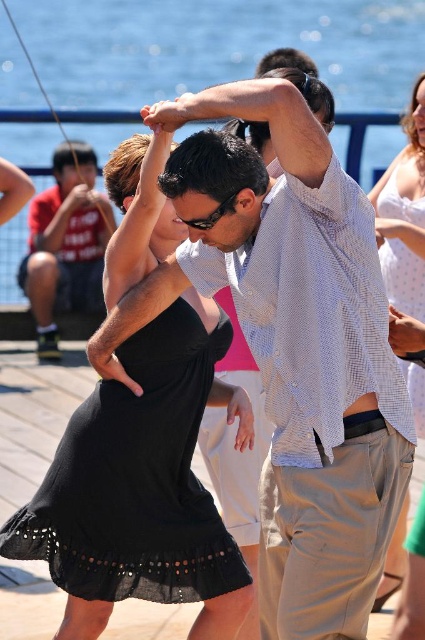
Does light blue woven shirt at center have a lesser width compared to matte black shirt at left?

No.

Can you confirm if light blue woven shirt at center is positioned below matte black shirt at left?

Yes, light blue woven shirt at center is below matte black shirt at left.

Is point (155, 276) positioned before point (51, 275)?

Yes, point (155, 276) is in front of point (51, 275).

Where is `light blue woven shirt at center`? The image size is (425, 640). light blue woven shirt at center is located at coordinates (291, 344).

Between black chiffon dress at center and matte black shirt at left, which one has more height?

matte black shirt at left

I want to click on black chiffon dress at center, so click(x=136, y=481).

The width and height of the screenshot is (425, 640). What do you see at coordinates (291, 344) in the screenshot?
I see `light blue woven shirt at center` at bounding box center [291, 344].

Is point (363, 339) more distant than point (404, 262)?

No.

Image resolution: width=425 pixels, height=640 pixels. What are the coordinates of `light blue woven shirt at center` in the screenshot? It's located at (291, 344).